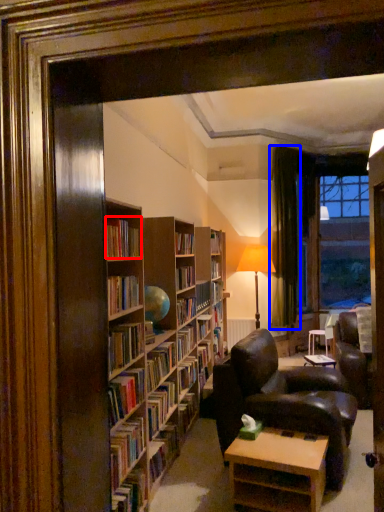
Question: Among these objects, which one is nearest to the camera, book (highlighted by a red box) or curtain (highlighted by a blue box)?

Choices:
 (A) book
 (B) curtain

Answer: (A)